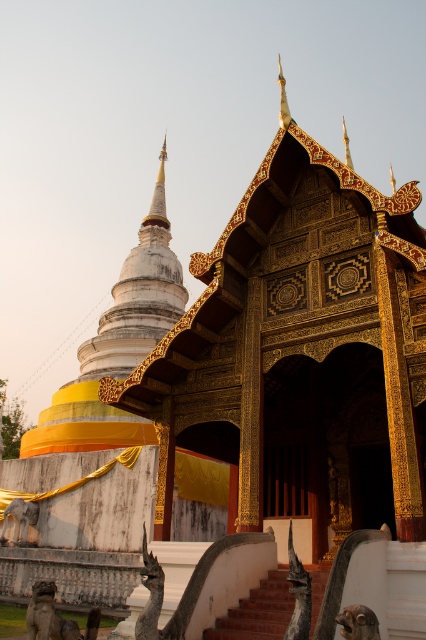
Question: Is shiny metallic monkey at lower center closer to camera compared to smooth stone dog at lower left?

Choices:
 (A) yes
 (B) no

Answer: (A)

Question: Is shiny metallic monkey at lower center above smooth stone dog at lower left?

Choices:
 (A) yes
 (B) no

Answer: (A)

Question: Which point is farther to the camera?

Choices:
 (A) smooth stone dog at lower left
 (B) terracotta brick stairs at center

Answer: (A)

Question: Does terracotta brick stairs at center appear under shiny metallic monkey at lower center?

Choices:
 (A) no
 (B) yes

Answer: (B)

Question: Which object is the farthest from the shiny bronze statue at lower left?

Choices:
 (A) terracotta brick stairs at center
 (B) shiny metallic monkey at lower center
 (C) smooth stone dog at lower left

Answer: (B)

Question: Which object is closer to the camera taking this photo?

Choices:
 (A) shiny bronze statue at lower left
 (B) smooth stone dog at lower left
 (C) shiny metallic monkey at lower center

Answer: (C)